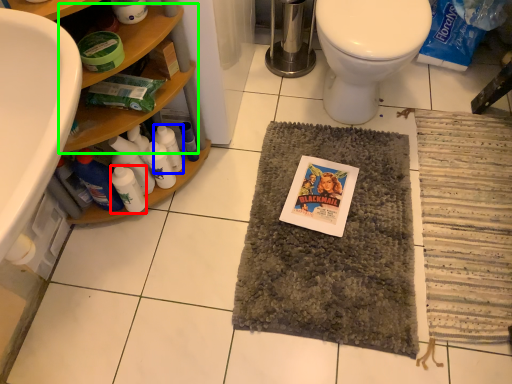
Question: Estimate the real-world distances between objects in this image. Which object is closer to bottle (highlighted by a red box), bottle (highlighted by a blue box) or shelf (highlighted by a green box)?

Choices:
 (A) bottle
 (B) shelf

Answer: (A)